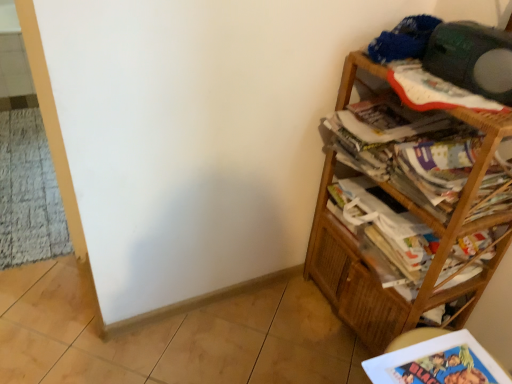
Question: From the image's perspective, is wooden bookcase at right positioned above or below printed paper magazine at right, the 1th magazine when ordered from bottom to top?

Choices:
 (A) below
 (B) above

Answer: (B)

Question: From a real-world perspective, is wooden bookcase at right physically located above or below printed paper magazine at right, the 2th magazine positioned from the top?

Choices:
 (A) above
 (B) below

Answer: (A)

Question: Estimate the real-world distances between objects in this image. Which object is closer to the printed paper magazine at right, the 2th magazine positioned from the top?

Choices:
 (A) wooden bookcase at right
 (B) white glossy book at lower right
 (C) green matte speaker at upper right
 (D) printed paper magazine at right, positioned as the second magazine in bottom-to-top order

Answer: (A)

Question: Which of these objects is positioned closest to the wooden bookcase at right?

Choices:
 (A) green matte speaker at upper right
 (B) printed paper magazine at right, the first magazine when ordered from top to bottom
 (C) white glossy book at lower right
 (D) printed paper magazine at right, the 2th magazine positioned from the top

Answer: (D)